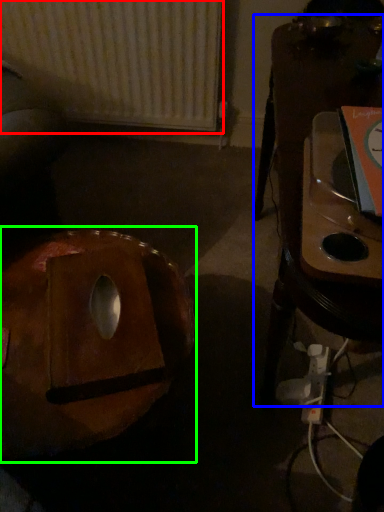
Question: Estimate the real-world distances between objects in this image. Which object is closer to radiator (highlighted by a red box), furniture (highlighted by a blue box) or bean bag chair (highlighted by a green box)?

Choices:
 (A) furniture
 (B) bean bag chair

Answer: (A)